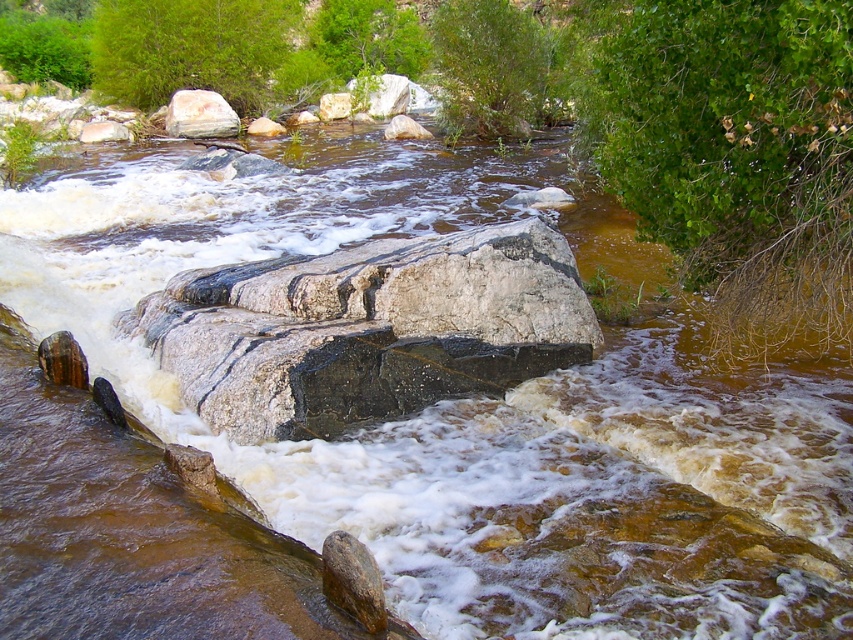
Can you confirm if white smooth rock at center is positioned above smooth gray rock at center?

Yes.

Measure the distance between point (392,113) and camera.

34.61 meters

Locate an element on the screen. white smooth rock at center is located at coordinates (399, 97).

Does point (320, 106) come in front of point (264, 120)?

No, (320, 106) is behind (264, 120).

Who is taller, white marble rock at center or smooth gray rock at center?

With more height is white marble rock at center.

Is point (332, 106) less distant than point (263, 134)?

No, (332, 106) is behind (263, 134).

The height and width of the screenshot is (640, 853). Find the location of `white marble rock at center`. white marble rock at center is located at coordinates (334, 106).

Is point (56, 19) positioned before point (401, 92)?

No, it is behind (401, 92).

Can you confirm if green leafy bush at upper left is positioned to the left of white smooth rock at center?

A: Correct, you'll find green leafy bush at upper left to the left of white smooth rock at center.

The image size is (853, 640). I want to click on green leafy bush at upper left, so click(44, 49).